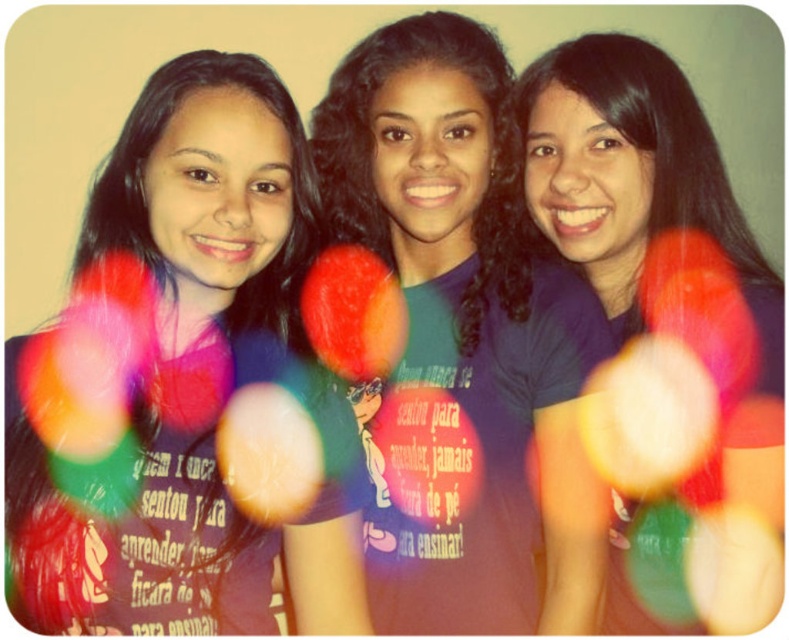
Question: Can you confirm if matte purple shirt at center is wider than dark green t-shirt at center?

Choices:
 (A) yes
 (B) no

Answer: (B)

Question: Among these points, which one is farthest from the camera?

Choices:
 (A) (406, 563)
 (B) (526, 74)

Answer: (B)

Question: Where is matte purple shirt at center located in relation to dark green t-shirt at center in the image?

Choices:
 (A) below
 (B) above

Answer: (A)

Question: Among these objects, which one is nearest to the camera?

Choices:
 (A) purple matte shirt at center
 (B) dark green t-shirt at center

Answer: (A)

Question: Which of the following is the farthest from the observer?

Choices:
 (A) purple matte shirt at center
 (B) matte purple shirt at center

Answer: (A)

Question: Is the position of matte purple shirt at center less distant than that of purple matte shirt at center?

Choices:
 (A) no
 (B) yes

Answer: (B)